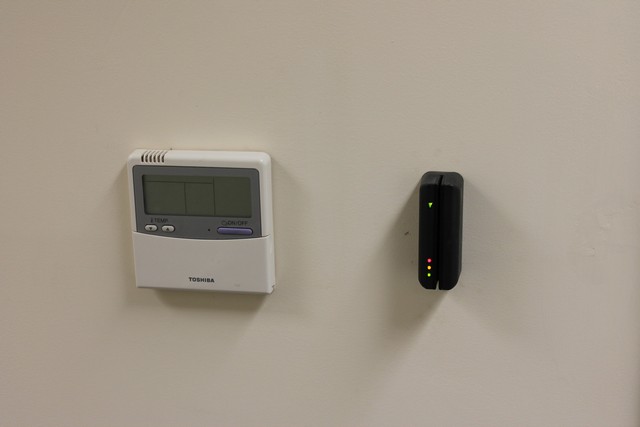
Locate an element on the screen. This screenshot has width=640, height=427. wall is located at coordinates (113, 76), (390, 68), (320, 299), (76, 353), (572, 344), (573, 110).